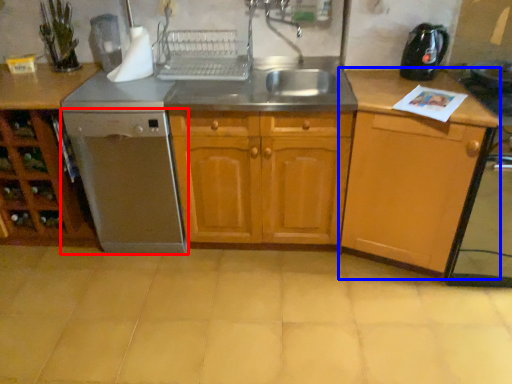
Question: Which object appears closest to the camera in this image, home appliance (highlighted by a red box) or cabinetry (highlighted by a blue box)?

Choices:
 (A) home appliance
 (B) cabinetry

Answer: (B)